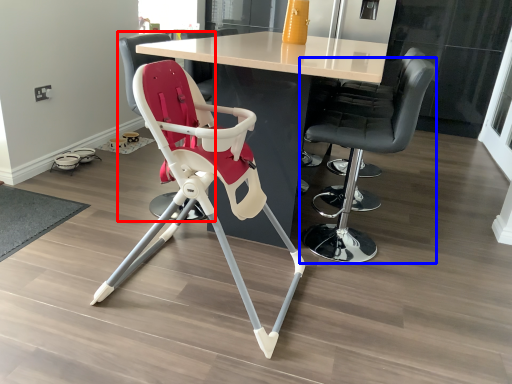
Question: Which of the following is the closest to the observer, chair (highlighted by a red box) or chair (highlighted by a blue box)?

Choices:
 (A) chair
 (B) chair

Answer: (B)